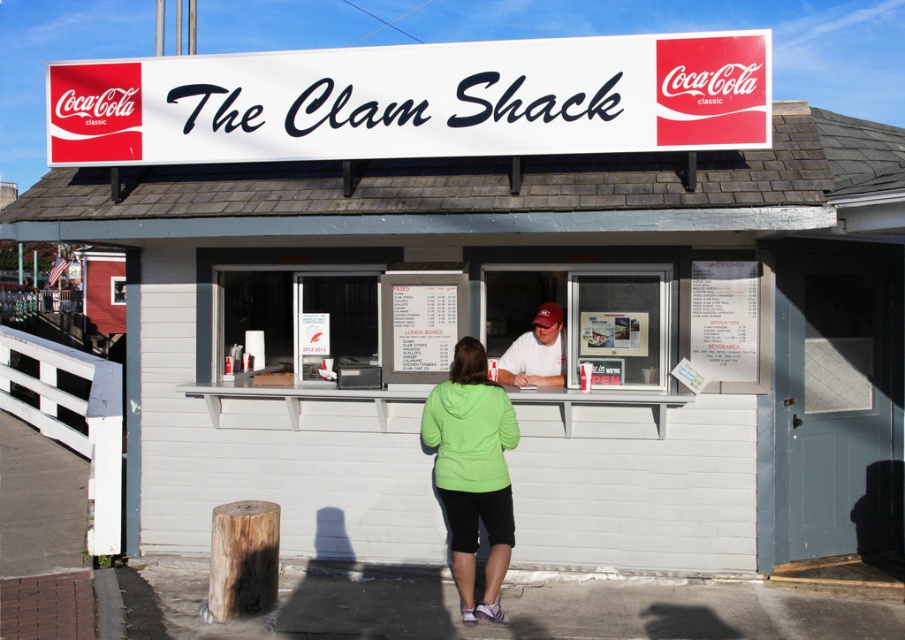
Can you confirm if green matte hoodie at center is shorter than matte white shirt at center?

Incorrect, green matte hoodie at center's height does not fall short of matte white shirt at center's.

This screenshot has height=640, width=905. Describe the element at coordinates (472, 472) in the screenshot. I see `green matte hoodie at center` at that location.

Find the location of a particular element. green matte hoodie at center is located at coordinates (472, 472).